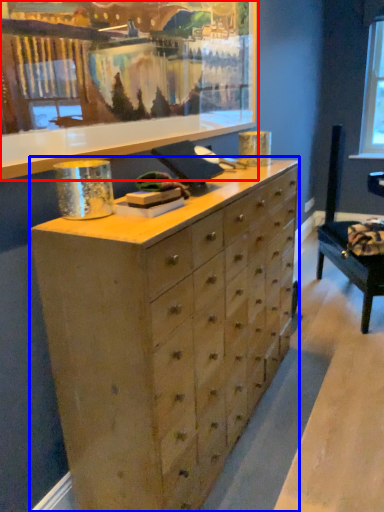
Question: Which object appears closest to the camera in this image, picture frame (highlighted by a red box) or chest of drawers (highlighted by a blue box)?

Choices:
 (A) picture frame
 (B) chest of drawers

Answer: (A)